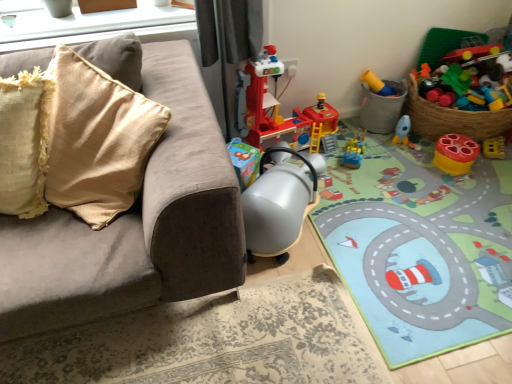
You are a GUI agent. You are given a task and a screenshot of the screen. Output one action in this format:
    pyautogui.click(x=<x>, y=<y>)
    Task: Click on the vacant space situated on the left part of matte plastic rocket at lower right, which appears as the 3th toy when viewed from the right
    The height and width of the screenshot is (384, 512).
    Given the screenshot: What is the action you would take?
    pyautogui.click(x=379, y=144)